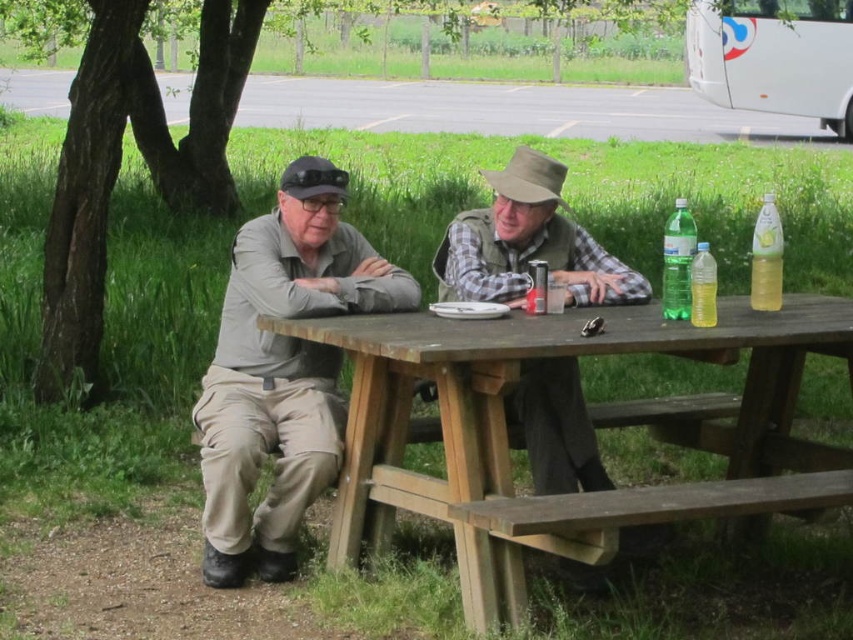
Question: Estimate the real-world distances between objects in this image. Which object is farther from the khaki cotton pants at left?

Choices:
 (A) green matte bottle at center
 (B) matte gray jacket at center
 (C) wooden picnic table at center
 (D) plaid fabric shirt at center

Answer: (A)

Question: Does matte gray jacket at center appear on the left side of translucent yellow bottle at table right?

Choices:
 (A) yes
 (B) no

Answer: (A)

Question: Which object is positioned closest to the khaki cotton pants at left?

Choices:
 (A) plaid fabric shirt at center
 (B) matte gray jacket at center
 (C) green matte bottle at center
 (D) yellow translucent bottle at right

Answer: (B)

Question: Observing the image, what is the correct spatial positioning of plaid fabric shirt at center in reference to translucent yellow bottle at table right?

Choices:
 (A) below
 (B) above

Answer: (A)

Question: Is khaki cotton pants at left thinner than yellow translucent bottle at right?

Choices:
 (A) no
 (B) yes

Answer: (A)

Question: Which point appears closest to the camera in this image?

Choices:
 (A) (274, 518)
 (B) (259, 424)
 (C) (701, 250)
 (D) (659, 528)

Answer: (C)